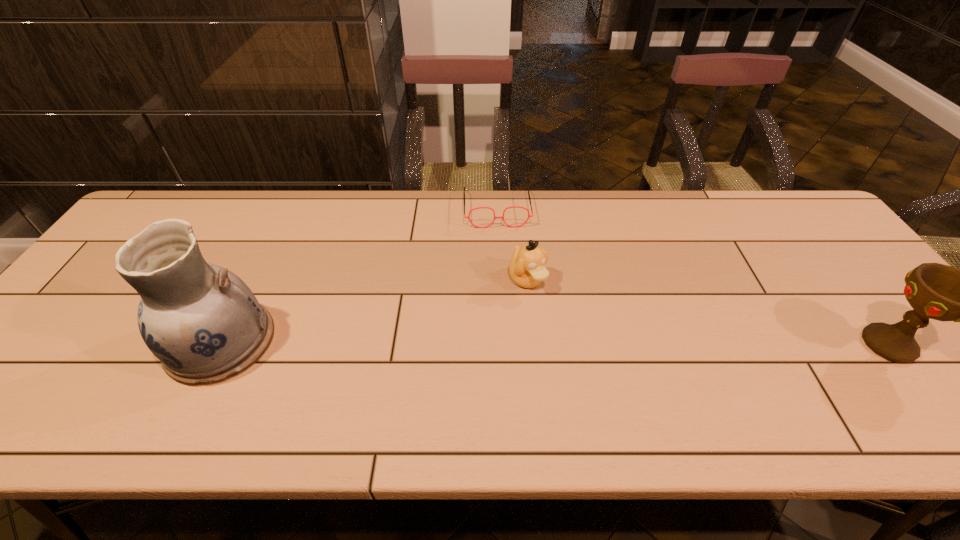
Image resolution: width=960 pixels, height=540 pixels. Find the location of `object identified as the third closest to the duckling`. object identified as the third closest to the duckling is located at coordinates (936, 291).